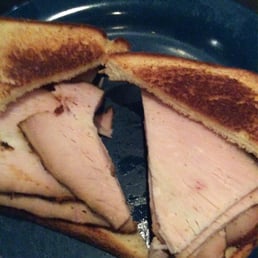
Find the location of a particular element. The width and height of the screenshot is (258, 258). water stain is located at coordinates (143, 224).